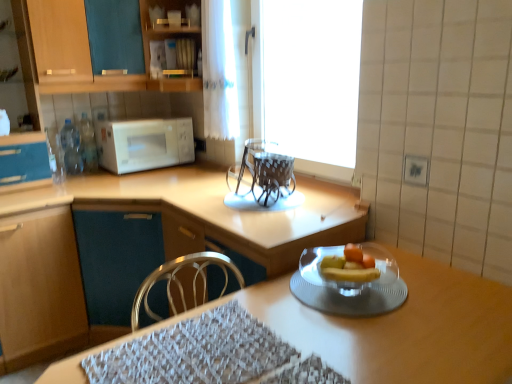
This screenshot has width=512, height=384. In order to click on vacant space to the right of woven fabric place mat at lower center in this screenshot , I will do `click(337, 340)`.